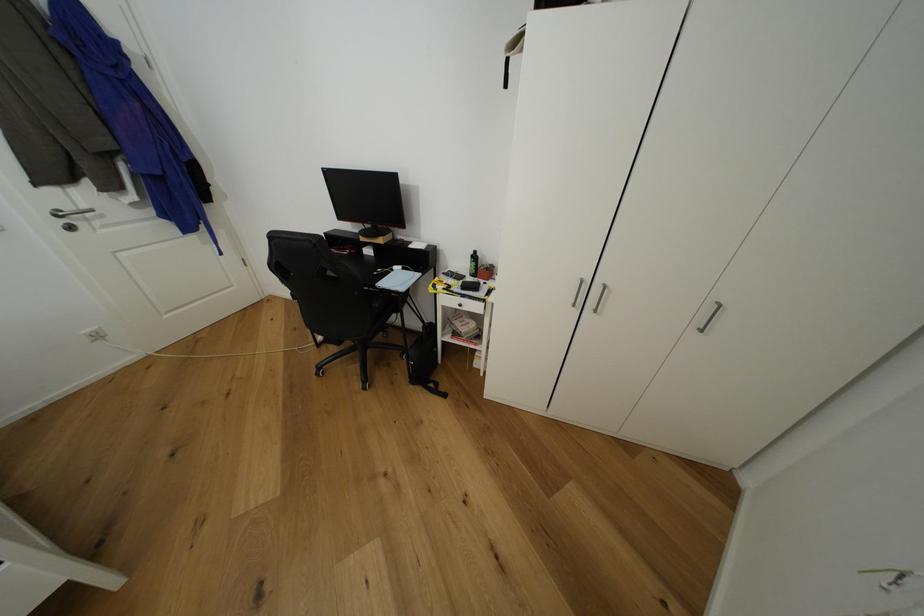
Find the location of `black backpack`. black backpack is located at coordinates (421, 355).